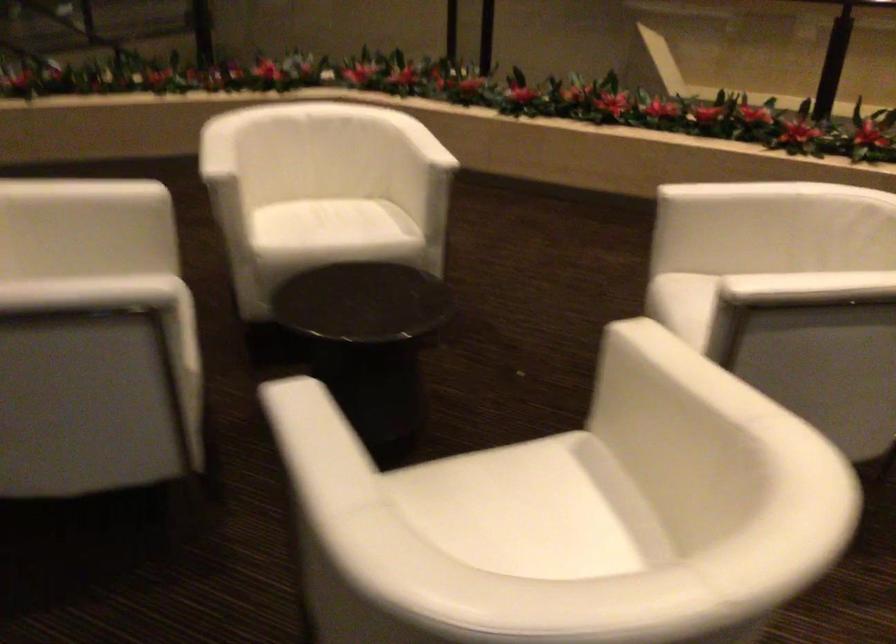
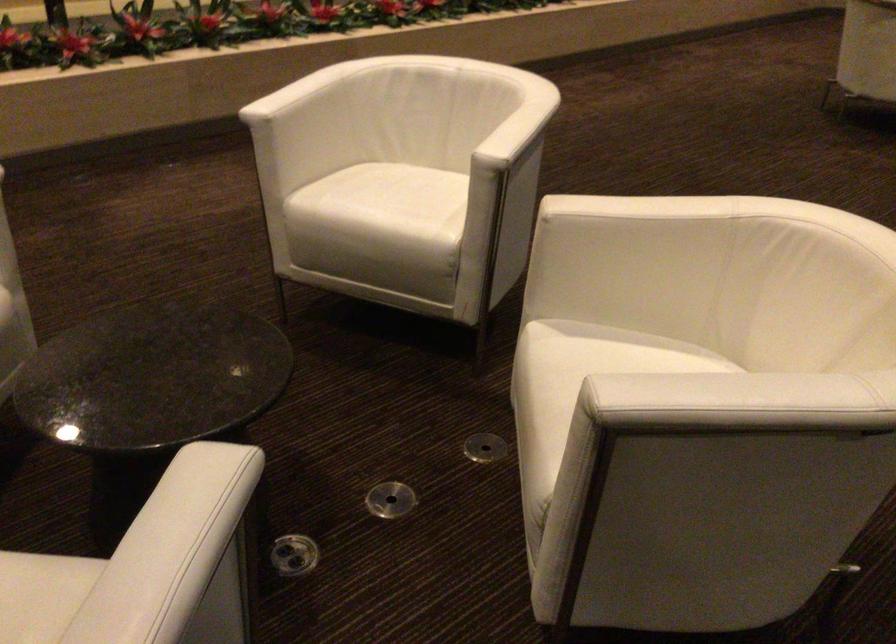
Where in the second image is the point corresponding to pixel 821 277 from the first image?

(515, 122)